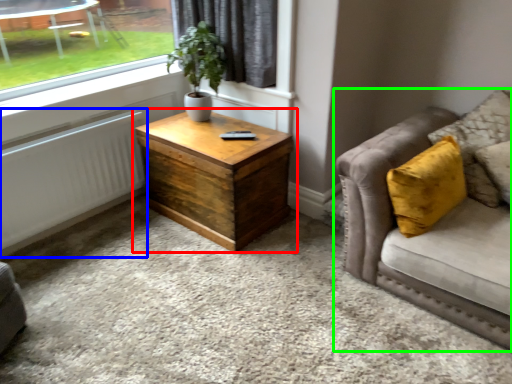
Question: Which is nearer to the coffee table (highlighted by a red box)? radiator (highlighted by a blue box) or studio couch (highlighted by a green box).

Choices:
 (A) radiator
 (B) studio couch

Answer: (A)